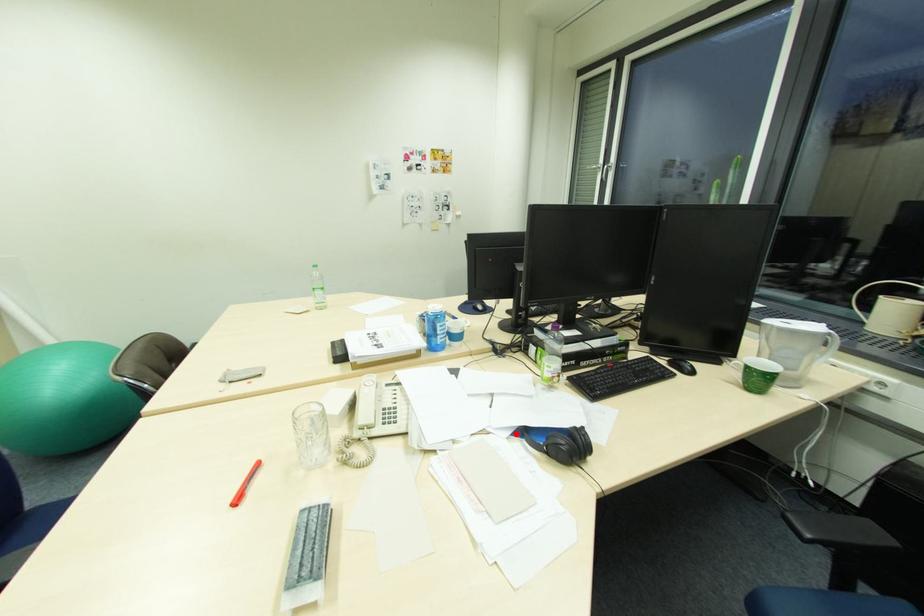
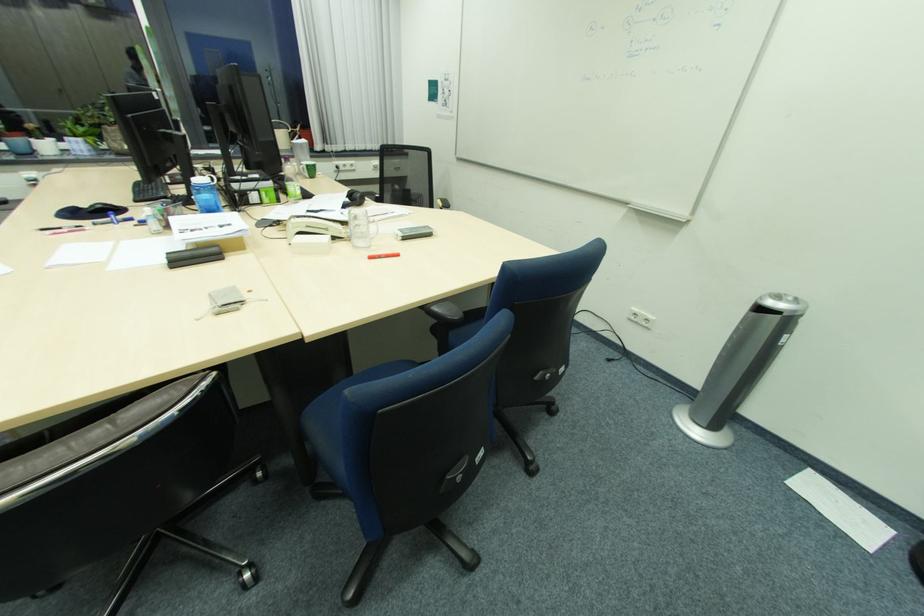
Where in the second image is the point corresponding to the highlighted location from the first image?

(349, 209)